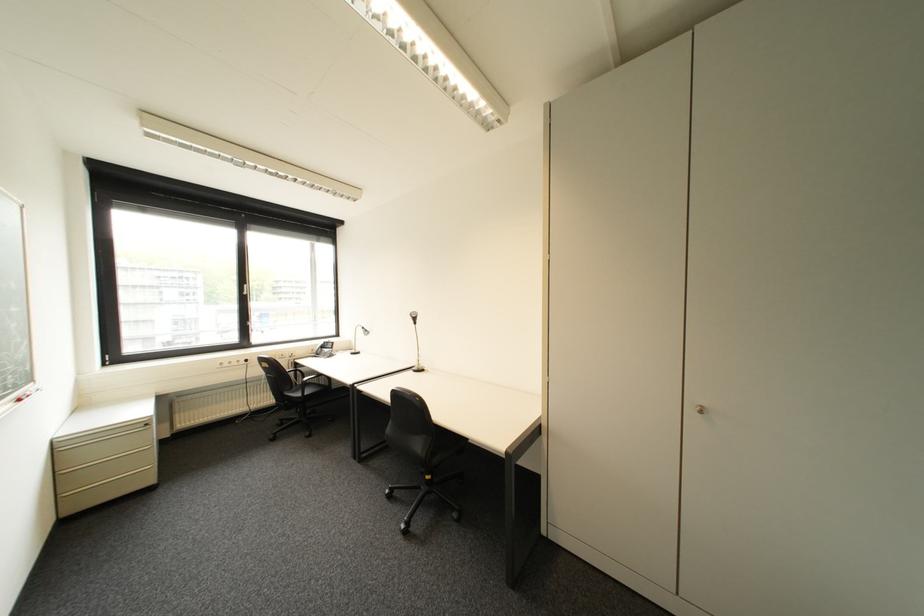
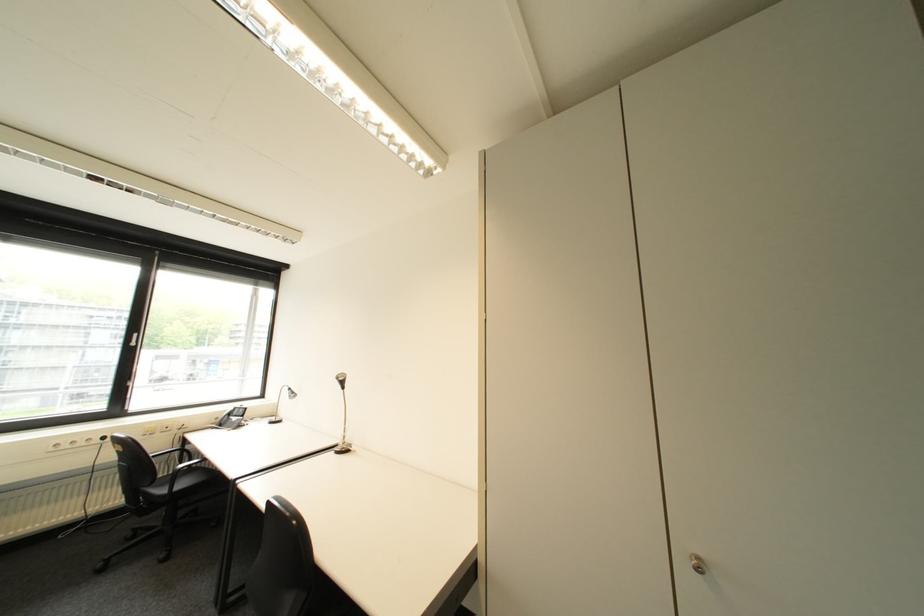
Where in the second image is the point corresponding to the point at 315,394 from the first image?

(187, 488)